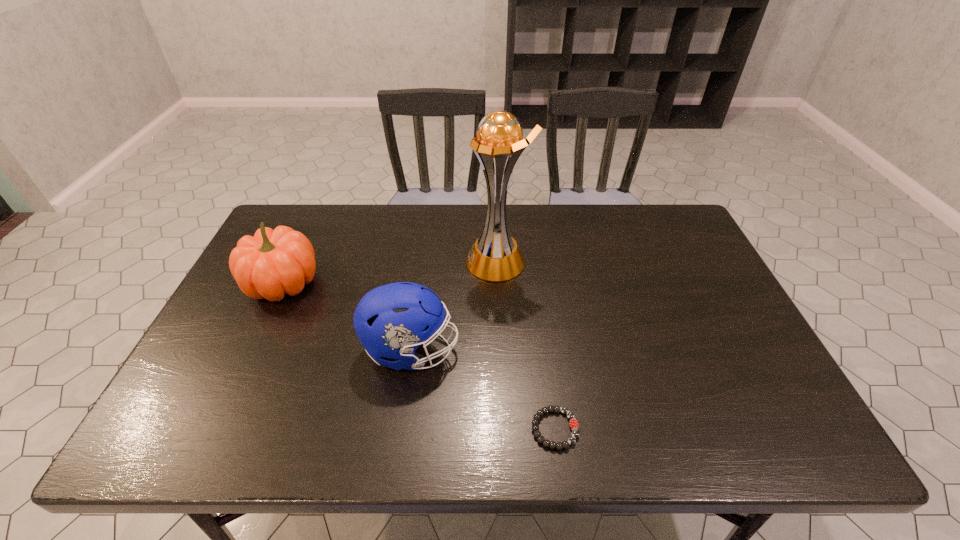
Locate an element on the screen. The image size is (960, 540). free spot between the third farthest object and the bracelet is located at coordinates (483, 389).

Where is `vacant space in between the trophy and the nearest object`? vacant space in between the trophy and the nearest object is located at coordinates (526, 345).

Locate an element on the screen. Image resolution: width=960 pixels, height=540 pixels. blank region between the nearest object and the football helmet is located at coordinates (483, 389).

The image size is (960, 540). Find the location of `unoccupied position between the football helmet and the pumpkin`. unoccupied position between the football helmet and the pumpkin is located at coordinates point(348,316).

This screenshot has width=960, height=540. In order to click on free space between the trophy and the shortest object in this screenshot , I will do `click(526, 345)`.

Find the location of a particular element. free point between the nearest object and the football helmet is located at coordinates (483, 389).

At what (x,y) coordinates should I click in order to perform the action: click on blank region between the trophy and the bracelet. Please return your answer as a coordinate pair (x, y). This screenshot has height=540, width=960. Looking at the image, I should click on (526, 345).

You are a GUI agent. You are given a task and a screenshot of the screen. Output one action in this format:
    pyautogui.click(x=<x>, y=<y>)
    Task: Click on the object that can be found as the third closest to the bracelet
    
    Given the screenshot: What is the action you would take?
    pyautogui.click(x=273, y=263)

Locate an element on the screen. the closest object relative to the nearest object is located at coordinates (391, 321).

Where is `free space that satisfies the following two spatial constraints: 1. on the face guard of the shortest object; 2. on the right side of the football helmet`? free space that satisfies the following two spatial constraints: 1. on the face guard of the shortest object; 2. on the right side of the football helmet is located at coordinates (400, 429).